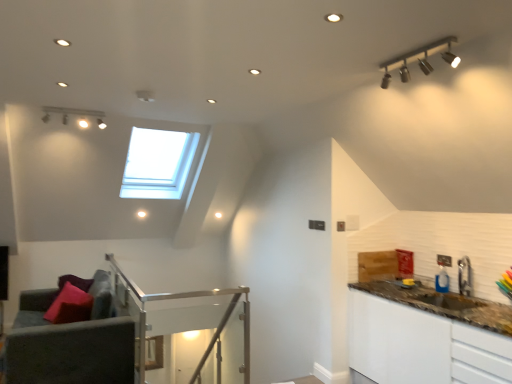
Identify the location of free point above matte silver track lights at upper right (from a real-world perspective). (412, 49).